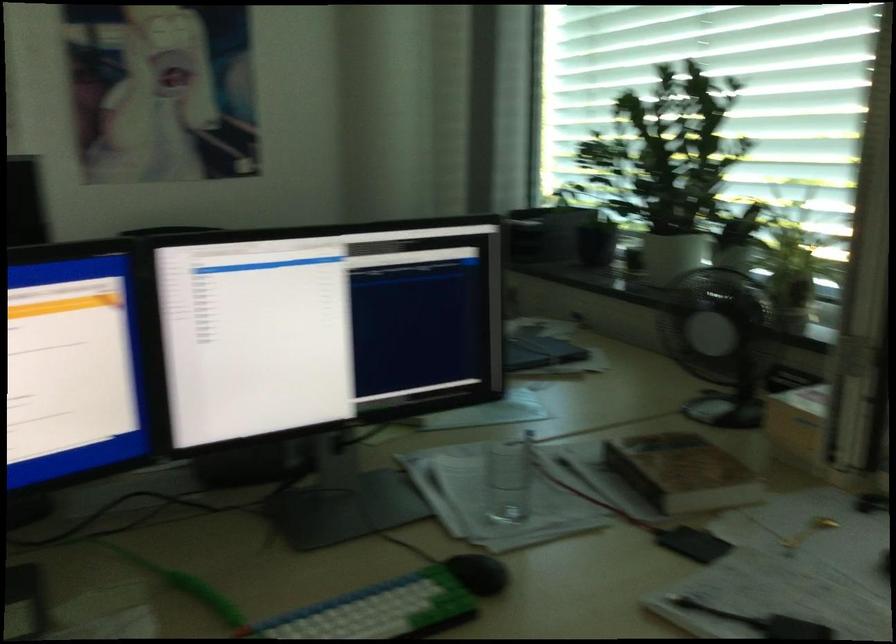
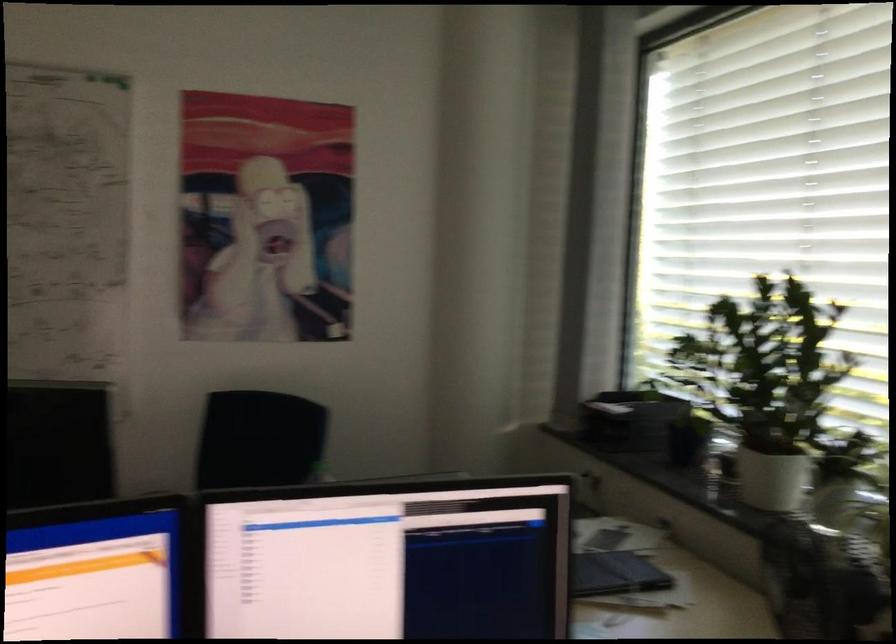
In a continuous first-person perspective shot, in which direction is the camera moving?

The movement direction of the cameraman is right, forward.